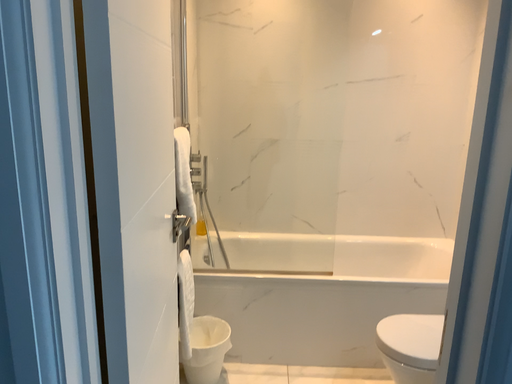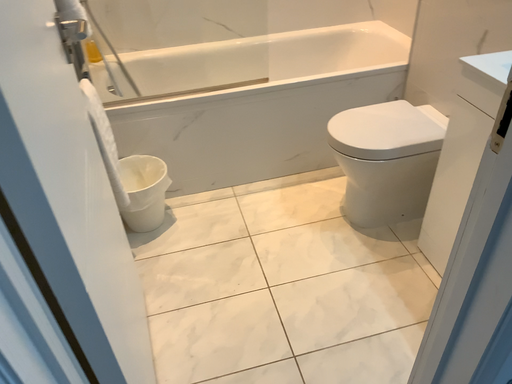
Question: Which way did the camera rotate in the video?

Choices:
 (A) rotated right
 (B) rotated left

Answer: (A)